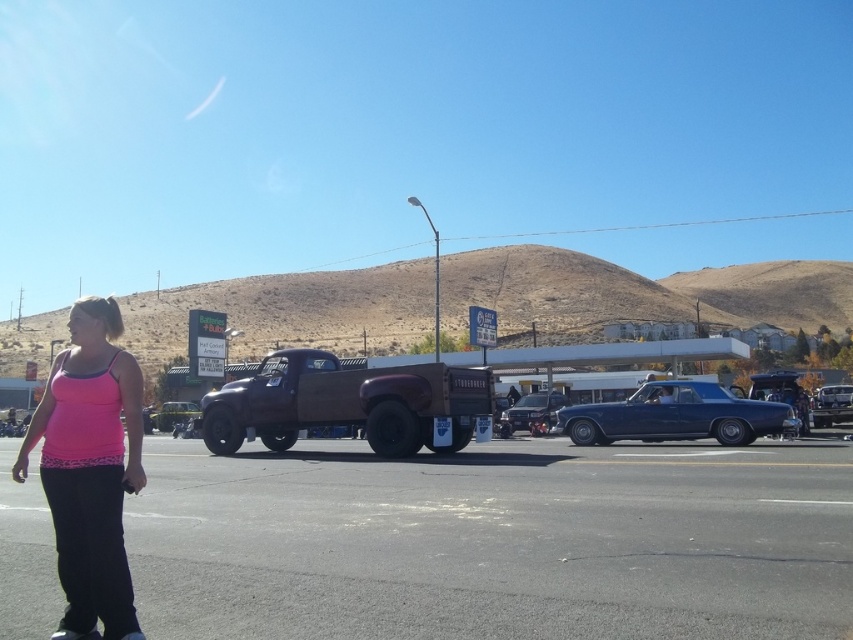
You are driving a car that needs to park in the space between the shiny blue car at center and the shiny chrome truck at center. The parking space is 5 meters long. Can your car fit in the space if your car is 4.5 meters long?

The shiny blue car at center is larger than the shiny chrome truck at center, but the parking space is 5 meters long. Since your car is only 4.5 meters long, it should fit comfortably within the space provided, as the space is longer than your car.

You are a photographer trying to capture the shiny chrome motorcycle at center and the shiny chrome truck at center in a single shot. Based on their positions, which one would appear closer to the bottom of the photo?

The shiny chrome motorcycle at center appears closer to the bottom of the photo because it is positioned below the shiny chrome truck at center.